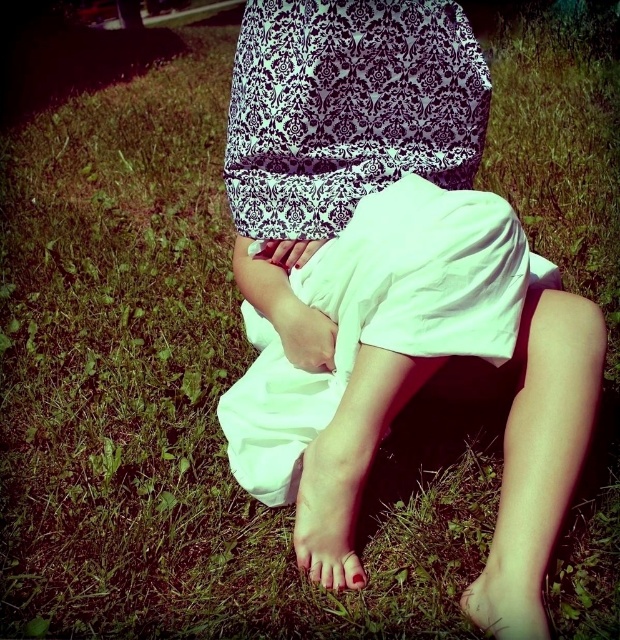
Is white cotton shorts at center above nude skin foot at lower center?

Indeed, white cotton shorts at center is positioned over nude skin foot at lower center.

Is white cotton shorts at center thinner than nude skin foot at lower center?

No.

This screenshot has height=640, width=620. I want to click on white cotton shorts at center, so click(x=339, y=132).